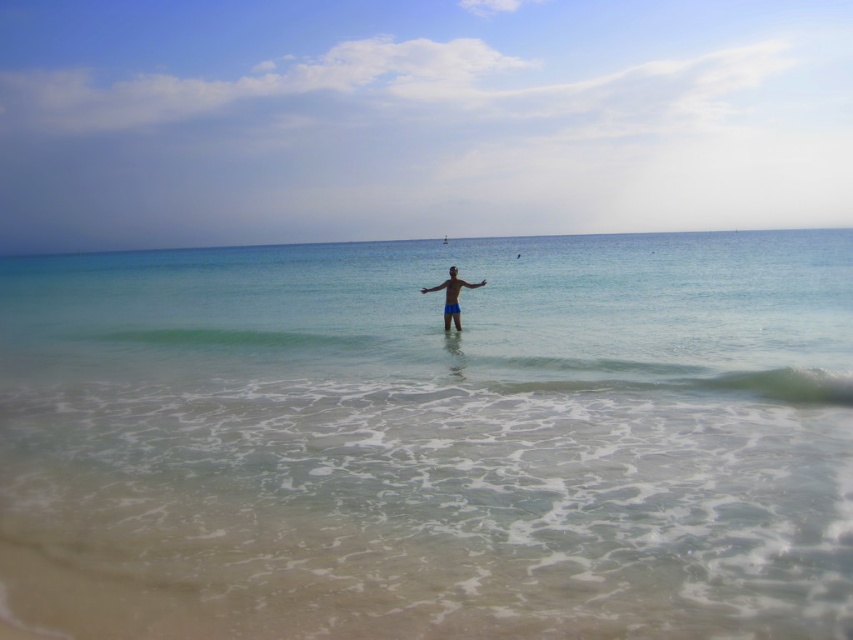
Who is positioned more to the left, clear blue water at center or blue matte shorts at center?

From the viewer's perspective, blue matte shorts at center appears more on the left side.

Locate an element on the screen. The width and height of the screenshot is (853, 640). clear blue water at center is located at coordinates (432, 440).

Identify the location of clear blue water at center. (x=432, y=440).